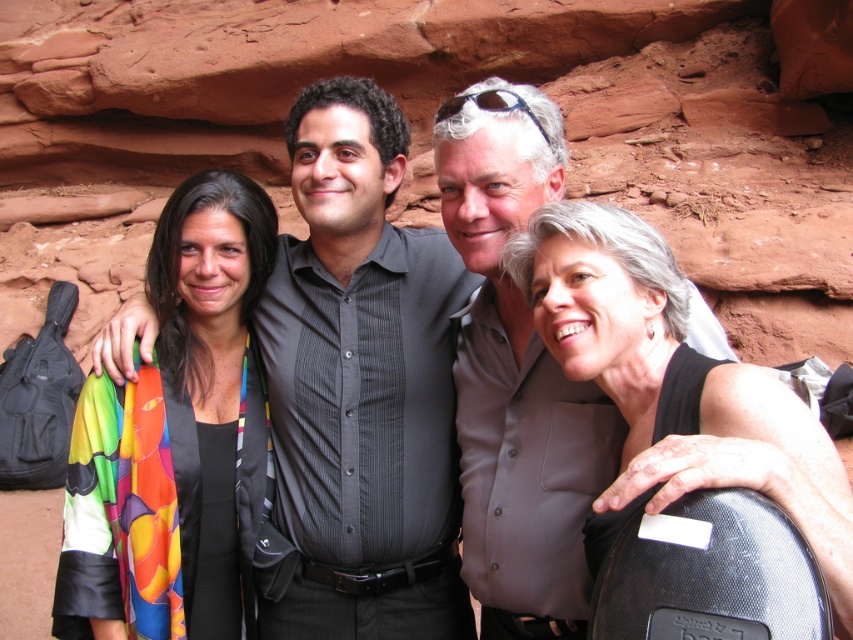
Question: Can you confirm if dark gray striped shirt at center is smaller than gray matte shirt at center?

Choices:
 (A) yes
 (B) no

Answer: (B)

Question: Which point is closer to the camera?

Choices:
 (A) (195, 580)
 (B) (558, 602)
 (C) (601, 259)
 (D) (293, 333)

Answer: (C)

Question: Based on their relative distances, which object is farther from the multicolored fabric scarf at left?

Choices:
 (A) dark gray striped shirt at center
 (B) gray matte shirt at center
 (C) black matte tank top at right

Answer: (C)

Question: Is gray matte shirt at center to the right of black matte tank top at right from the viewer's perspective?

Choices:
 (A) no
 (B) yes

Answer: (A)

Question: Can you confirm if dark gray striped shirt at center is positioned above black matte tank top at right?

Choices:
 (A) no
 (B) yes

Answer: (B)

Question: Which object appears closest to the camera in this image?

Choices:
 (A) dark gray striped shirt at center
 (B) gray matte shirt at center

Answer: (B)